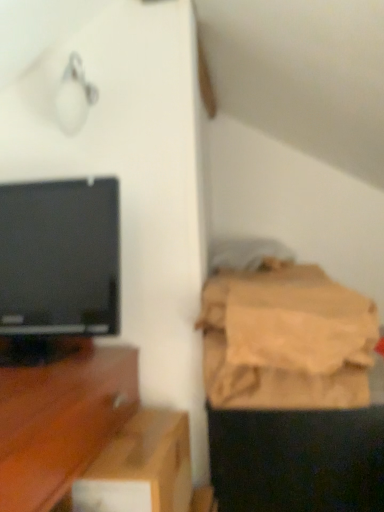
Question: Is black glossy television at left in front of wooden tv stand at left?

Choices:
 (A) yes
 (B) no

Answer: (B)

Question: Is black glossy television at left bigger than wooden tv stand at left?

Choices:
 (A) no
 (B) yes

Answer: (A)

Question: Considering the relative positions of black glossy television at left and wooden tv stand at left in the image provided, is black glossy television at left behind wooden tv stand at left?

Choices:
 (A) yes
 (B) no

Answer: (A)

Question: Considering the relative sizes of black glossy television at left and wooden tv stand at left in the image provided, is black glossy television at left shorter than wooden tv stand at left?

Choices:
 (A) no
 (B) yes

Answer: (B)

Question: From a real-world perspective, is black glossy television at left located higher than wooden tv stand at left?

Choices:
 (A) no
 (B) yes

Answer: (B)

Question: Considering the positions of point (41, 236) and point (220, 345), is point (41, 236) closer or farther from the camera than point (220, 345)?

Choices:
 (A) farther
 (B) closer

Answer: (B)

Question: Would you say black glossy television at left is inside or outside brown fabric bag at right?

Choices:
 (A) inside
 (B) outside

Answer: (B)

Question: In terms of width, does black glossy television at left look wider or thinner when compared to brown fabric bag at right?

Choices:
 (A) wide
 (B) thin

Answer: (B)

Question: Would you say black glossy television at left is to the left or to the right of brown fabric bag at right in the picture?

Choices:
 (A) left
 (B) right

Answer: (A)

Question: Relative to wooden tv stand at left, is black glossy television at left in front or behind?

Choices:
 (A) front
 (B) behind

Answer: (B)

Question: Considering the positions of black glossy television at left and wooden tv stand at left in the image, is black glossy television at left taller or shorter than wooden tv stand at left?

Choices:
 (A) tall
 (B) short

Answer: (B)

Question: In terms of width, does black glossy television at left look wider or thinner when compared to wooden tv stand at left?

Choices:
 (A) thin
 (B) wide

Answer: (A)

Question: From the image's perspective, relative to wooden tv stand at left, is black glossy television at left above or below?

Choices:
 (A) above
 (B) below

Answer: (A)

Question: Looking at their shapes, would you say black glossy television at left is wider or thinner than brown cardboard box at lower center?

Choices:
 (A) wide
 (B) thin

Answer: (A)

Question: From a real-world perspective, is black glossy television at left positioned above or below brown cardboard box at lower center?

Choices:
 (A) above
 (B) below

Answer: (A)